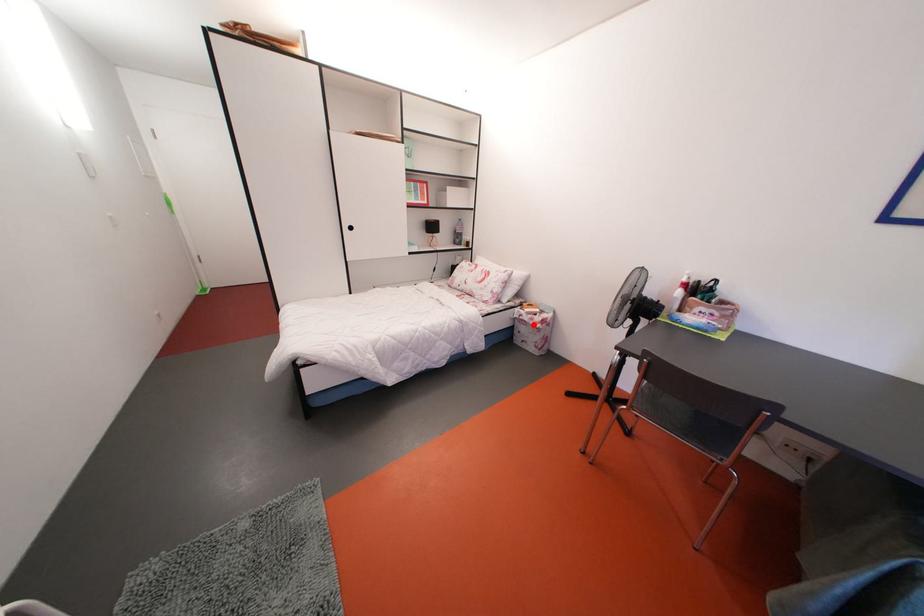
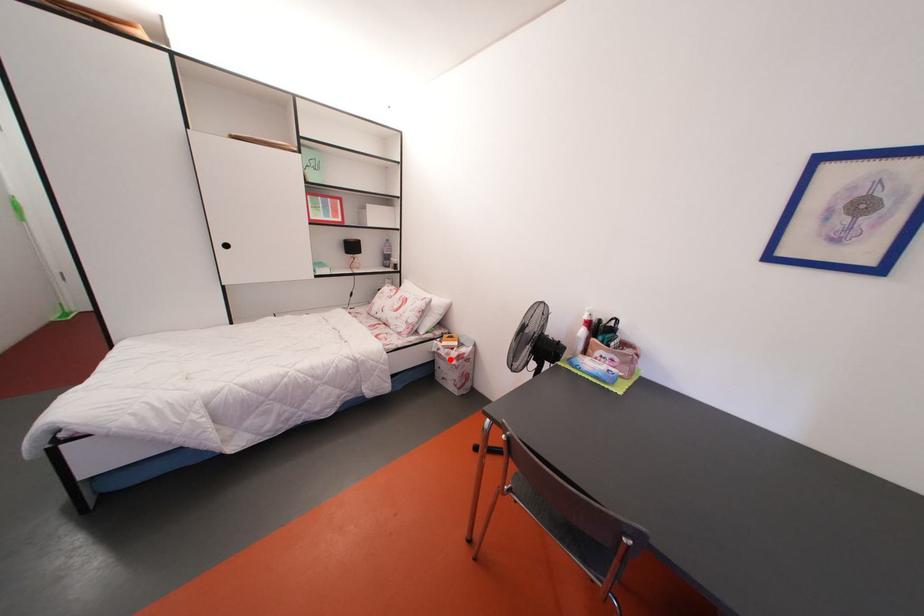
I am providing you with two images of the same scene from different viewpoints. A red point is marked on the first image and another point is marked on the second image. Do the highlighted points in image1 and image2 indicate the same real-world spot?

Yes